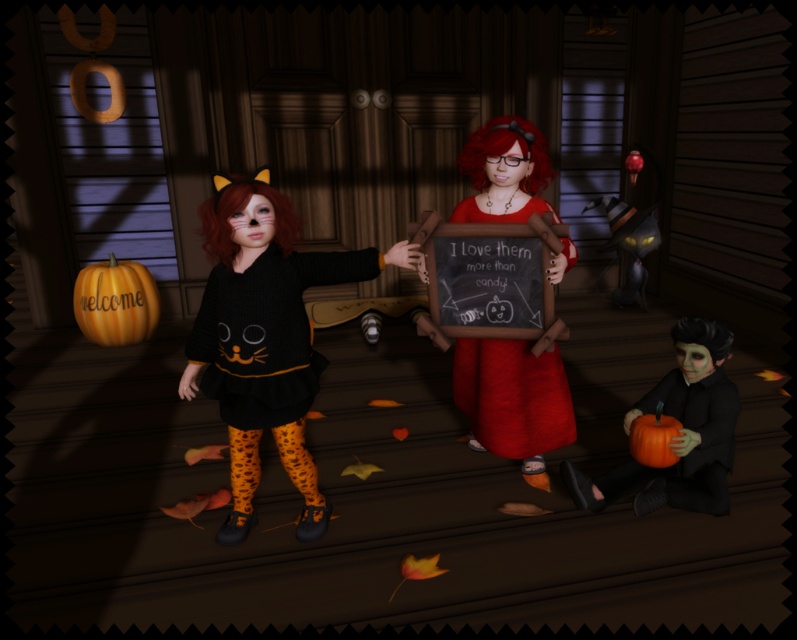
Can you confirm if black knit dress at center is taller than orange matte pumpkin at lower left?

Yes, black knit dress at center is taller than orange matte pumpkin at lower left.

Is black knit dress at center shorter than orange matte pumpkin at lower left?

No, black knit dress at center is not shorter than orange matte pumpkin at lower left.

Who is more distant from viewer, (277,397) or (135,330)?

Positioned behind is point (135,330).

Where is `black knit dress at center`? black knit dress at center is located at coordinates (265, 337).

Does knitted/black dress at center come in front of orange matte pumpkin at lower right?

Yes, knitted/black dress at center is closer to the viewer.

Between knitted/black dress at center and orange matte pumpkin at lower right, which one is positioned lower?

orange matte pumpkin at lower right is lower down.

The width and height of the screenshot is (797, 640). Find the location of `knitted/black dress at center`. knitted/black dress at center is located at coordinates [265, 332].

Can you confirm if matte red dress at center is smaller than matte black pumpkin at lower right?

No.

Which is more to the left, matte red dress at center or matte black pumpkin at lower right?

Positioned to the left is matte red dress at center.

At what (x,y) coordinates should I click in order to perform the action: click on matte red dress at center. Please return your answer as a coordinate pair (x, y). This screenshot has width=797, height=640. Looking at the image, I should click on (513, 397).

The width and height of the screenshot is (797, 640). Find the location of `matte red dress at center`. matte red dress at center is located at coordinates (513, 397).